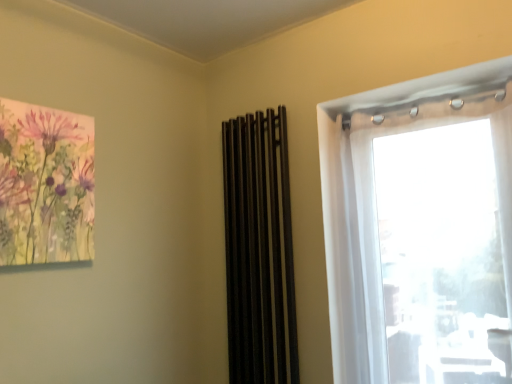
This screenshot has height=384, width=512. What do you see at coordinates (421, 237) in the screenshot?
I see `transparent fabric at right` at bounding box center [421, 237].

Identify the location of transparent fabric at right. The height and width of the screenshot is (384, 512). (421, 237).

This screenshot has width=512, height=384. I want to click on black matte curtain at center, so click(259, 250).

What do you see at coordinates (259, 250) in the screenshot? I see `black matte curtain at center` at bounding box center [259, 250].

Find the location of `transparent fabric at right`. transparent fabric at right is located at coordinates (421, 237).

Between black matte curtain at center and transparent fabric at right, which one appears on the right side from the viewer's perspective?

From the viewer's perspective, transparent fabric at right appears more on the right side.

Is black matte curtain at center closer to camera compared to transparent fabric at right?

No, black matte curtain at center is further to the viewer.

Does point (237, 214) come behind point (396, 156)?

Yes.

From the image's perspective, which one is positioned higher, black matte curtain at center or transparent fabric at right?

transparent fabric at right is shown above in the image.

From a real-world perspective, is black matte curtain at center physically below transparent fabric at right?

No, from a real-world perspective, black matte curtain at center is not under transparent fabric at right.

Looking at this image, can you confirm if black matte curtain at center is thinner than transparent fabric at right?

Yes, black matte curtain at center is thinner than transparent fabric at right.

Between black matte curtain at center and transparent fabric at right, which one has less height?

transparent fabric at right is shorter.

Who is bigger, black matte curtain at center or transparent fabric at right?

With larger size is transparent fabric at right.

Is black matte curtain at center situated inside transparent fabric at right or outside?

black matte curtain at center is not enclosed by transparent fabric at right.

Are black matte curtain at center and transparent fabric at right making contact?

No, black matte curtain at center is not next to transparent fabric at right.

Consider the image. Is transparent fabric at right at the back of black matte curtain at center?

No, transparent fabric at right is not at the back of black matte curtain at center.

How many degrees apart are the facing directions of black matte curtain at center and transparent fabric at right?

The angle between the facing direction of black matte curtain at center and the facing direction of transparent fabric at right is 0.199 degrees.

This screenshot has height=384, width=512. I want to click on curtain on the left of transparent fabric at right, so click(x=259, y=250).

Considering the relative positions of transparent fabric at right and black matte curtain at center in the image provided, is transparent fabric at right to the left or to the right of black matte curtain at center?

In the image, transparent fabric at right appears on the right side of black matte curtain at center.

Between transparent fabric at right and black matte curtain at center, which one is positioned in front?

Positioned in front is transparent fabric at right.

Which is behind, point (370, 159) or point (231, 317)?

The point (231, 317) is more distant.

From the image's perspective, relative to black matte curtain at center, is transparent fabric at right above or below?

Based on their image positions, transparent fabric at right is located above black matte curtain at center.

Based on the photo, from a real-world perspective, relative to black matte curtain at center, is transparent fabric at right vertically above or below?

transparent fabric at right is situated lower than black matte curtain at center in the real world.

Which of these two, transparent fabric at right or black matte curtain at center, is thinner?

black matte curtain at center is thinner.

Which of these two, transparent fabric at right or black matte curtain at center, stands shorter?

transparent fabric at right.

Which of these two, transparent fabric at right or black matte curtain at center, is smaller?

black matte curtain at center.

Could black matte curtain at center be considered to be inside transparent fabric at right?

No, black matte curtain at center is located outside of transparent fabric at right.

Is transparent fabric at right next to black matte curtain at center and touching it?

They are not placed beside each other.

Could you tell me if transparent fabric at right is turned towards black matte curtain at center?

No, transparent fabric at right does not turn towards black matte curtain at center.

Measure the distance between transparent fabric at right and black matte curtain at center.

18.99 inches.

Where is `window in front of the black matte curtain at center`? The width and height of the screenshot is (512, 384). window in front of the black matte curtain at center is located at coordinates (421, 237).

Image resolution: width=512 pixels, height=384 pixels. I want to click on window on the right of black matte curtain at center, so click(421, 237).

Locate an element on the screen. curtain above the transparent fabric at right (from a real-world perspective) is located at coordinates (259, 250).